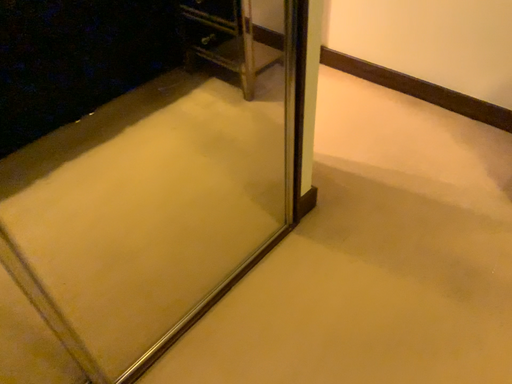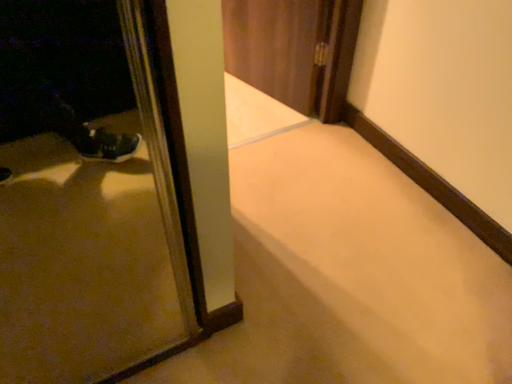
Question: How did the camera likely rotate when shooting the video?

Choices:
 (A) rotated right
 (B) rotated left

Answer: (B)